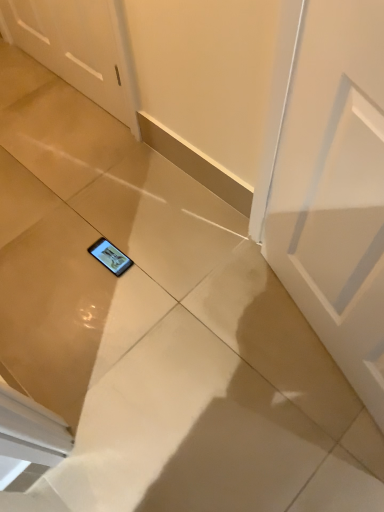
This screenshot has height=512, width=384. I want to click on matte black tablet at center, so click(x=110, y=256).

What do you see at coordinates (110, 256) in the screenshot?
I see `matte black tablet at center` at bounding box center [110, 256].

Locate an element on the screen. The width and height of the screenshot is (384, 512). matte black tablet at center is located at coordinates (110, 256).